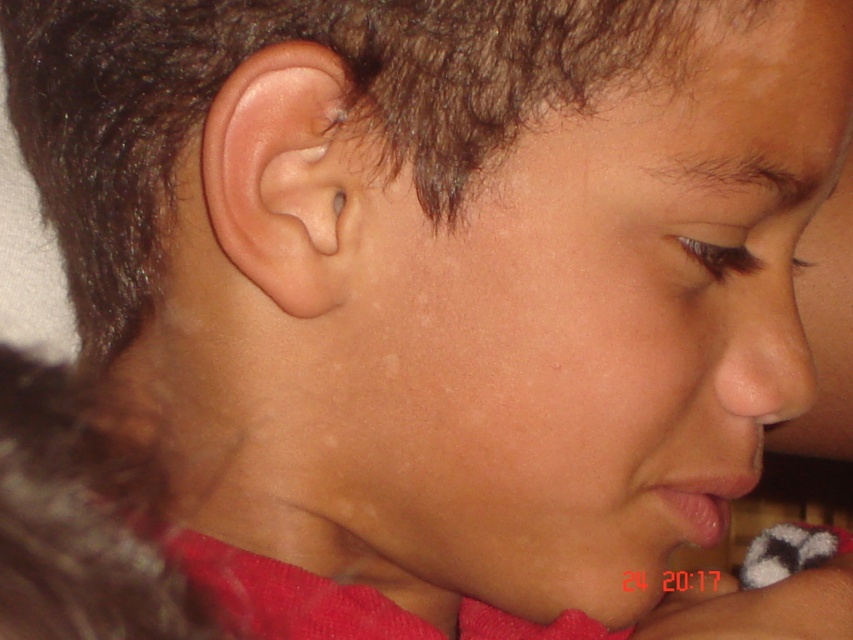
Based on the scene description, where is the matte skin nose at right located in terms of its 2D coordinates?

The matte skin nose at right is located at the 2D coordinates of point (763, 348).